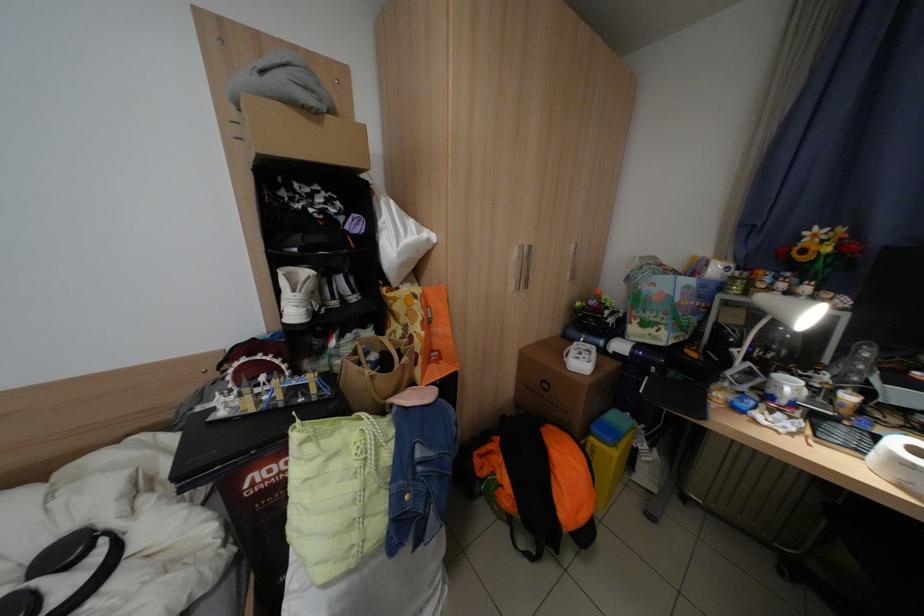
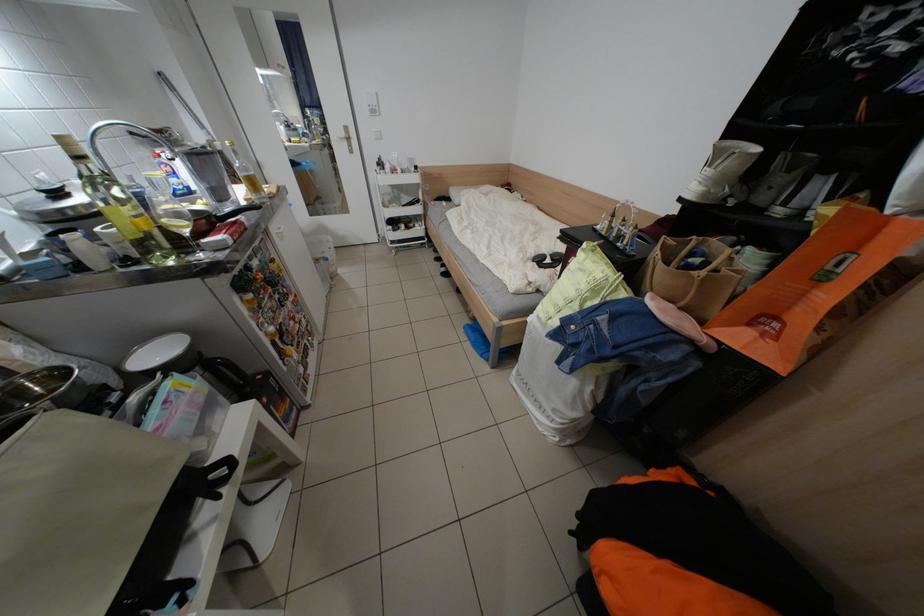
Based on the continuous images, in which direction is the camera rotating?

The rotation direction of the camera is left-down.